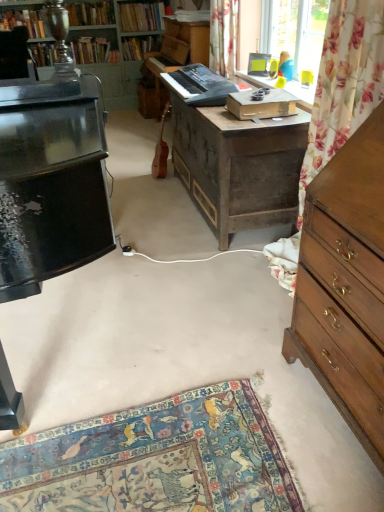
The image size is (384, 512). I want to click on vacant space that is in between wooden chest of drawers at right and black glossy piano at left, acting as the third piano starting from the back, so click(211, 375).